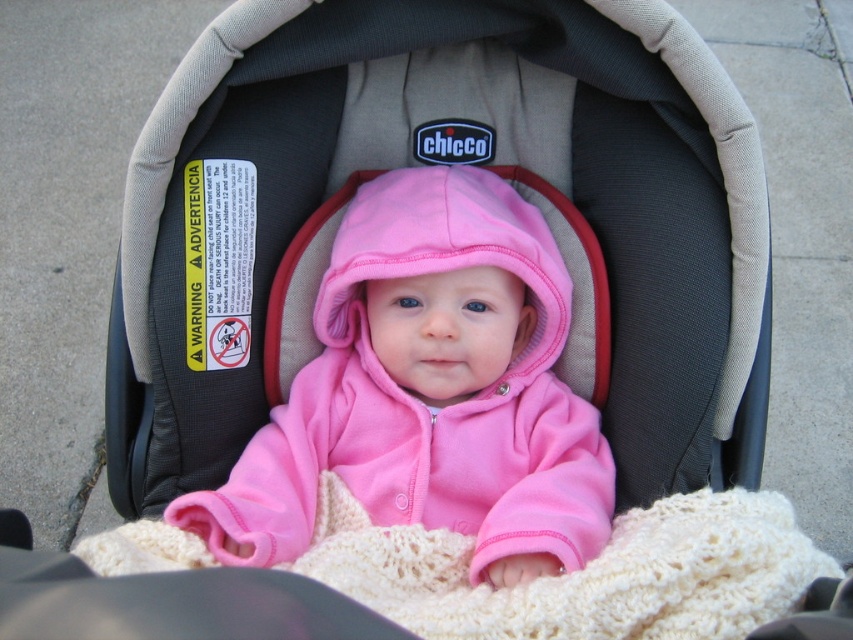
Question: From the image, what is the correct spatial relationship of pink fleece baby at center in relation to creamy knit blanket at center?

Choices:
 (A) right
 (B) left

Answer: (B)

Question: Which of the following is the closest to the observer?

Choices:
 (A) creamy knit blanket at center
 (B) pink fleece baby at center

Answer: (A)

Question: Can you confirm if pink fleece baby at center is positioned to the left of creamy knit blanket at center?

Choices:
 (A) no
 (B) yes

Answer: (B)

Question: Can you confirm if pink fleece baby at center is positioned below creamy knit blanket at center?

Choices:
 (A) yes
 (B) no

Answer: (B)